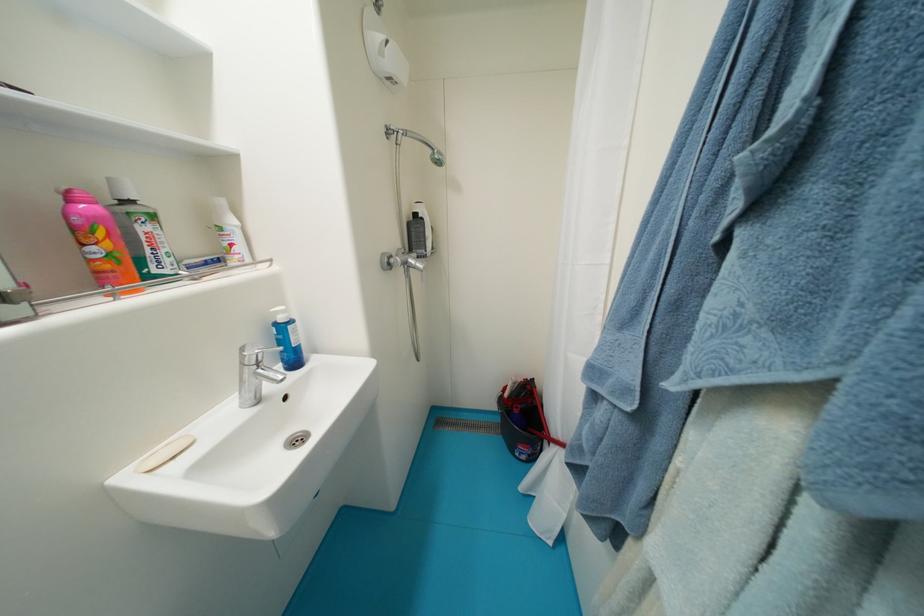
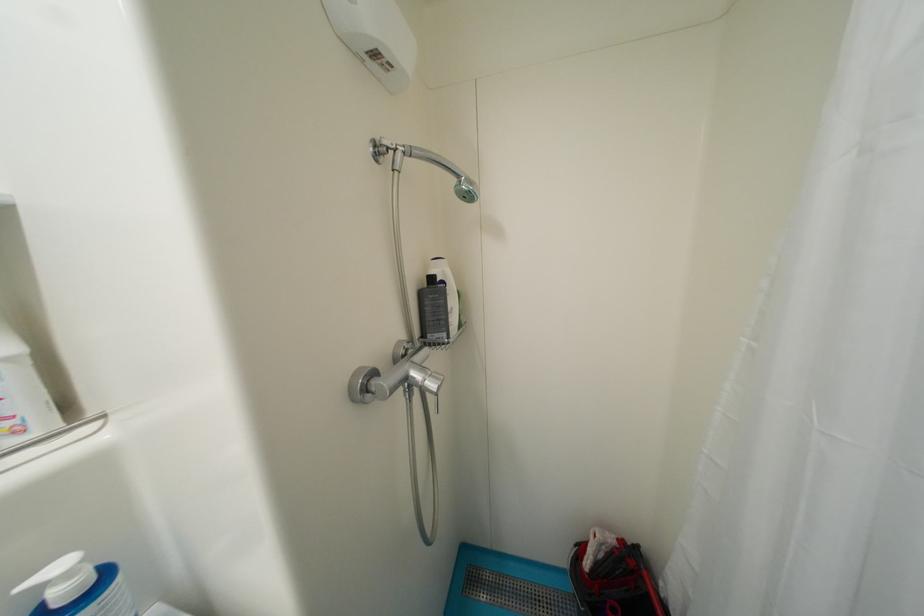
Locate, in the second image, the point that corresponds to [421,217] in the first image.

(439, 281)